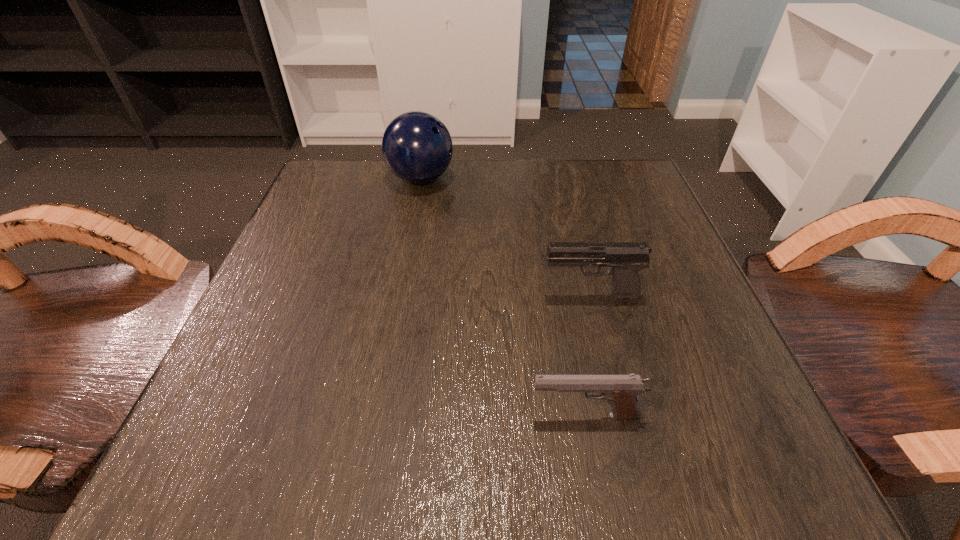
You are a GUI agent. You are given a task and a screenshot of the screen. Output one action in this format:
    pyautogui.click(x=<x>, y=<y>)
    Task: Click on the free spot between the second tallest object and the bowling ball
    
    Given the screenshot: What is the action you would take?
    pyautogui.click(x=505, y=238)

Find the location of a particular element. The image size is (960, 540). vacant area between the leftmost object and the second shortest object is located at coordinates (505, 238).

At what (x,y) coordinates should I click in order to perform the action: click on vacant space that's between the tallest object and the nearer pistol. Please return your answer as a coordinate pair (x, y). Looking at the image, I should click on (503, 297).

This screenshot has height=540, width=960. I want to click on vacant space that's between the nearer pistol and the farthest object, so click(x=503, y=297).

Find the location of `free space between the shorter pistol and the taller pistol`. free space between the shorter pistol and the taller pistol is located at coordinates (588, 356).

Locate an element on the screen. Image resolution: width=960 pixels, height=540 pixels. object that stands as the closest to the shortest object is located at coordinates (626, 259).

Where is `object that stands as the second closest to the nearer pistol`? The height and width of the screenshot is (540, 960). object that stands as the second closest to the nearer pistol is located at coordinates (417, 147).